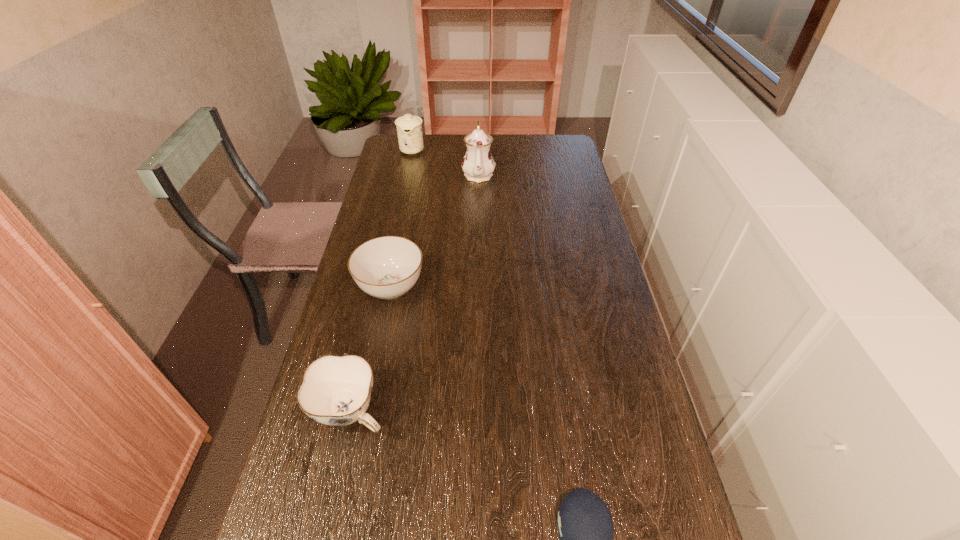
The height and width of the screenshot is (540, 960). What are the coordinates of `the third nearest chinaware` in the screenshot? It's located at (478, 164).

At what (x,y) coordinates should I click in order to perform the action: click on the fourth nearest object. Please return your answer as a coordinate pair (x, y). The height and width of the screenshot is (540, 960). Looking at the image, I should click on (478, 164).

At what (x,y) coordinates should I click in order to perform the action: click on the fourth shortest object. Please return your answer as a coordinate pair (x, y). Image resolution: width=960 pixels, height=540 pixels. Looking at the image, I should click on (409, 127).

The image size is (960, 540). What are the coordinates of `the farthest chinaware` in the screenshot? It's located at (409, 127).

Locate an element on the screen. The image size is (960, 540). the second nearest chinaware is located at coordinates (386, 267).

Locate an element on the screen. the fourth farthest object is located at coordinates (336, 390).

In order to click on blank space located on the left of the tallest object in this screenshot , I will do pos(437,174).

At what (x,y) coordinates should I click in order to perform the action: click on vacant space positioned 0.370m on the spout of the second tallest object. Please return your answer as a coordinate pair (x, y). Looking at the image, I should click on (398, 214).

At what (x,y) coordinates should I click in order to perform the action: click on free space located on the back of the third farthest chinaware. Please return your answer as a coordinate pair (x, y). Looking at the image, I should click on (404, 219).

Image resolution: width=960 pixels, height=540 pixels. Identify the location of free spot located on the right of the fourth farthest object. (505, 411).